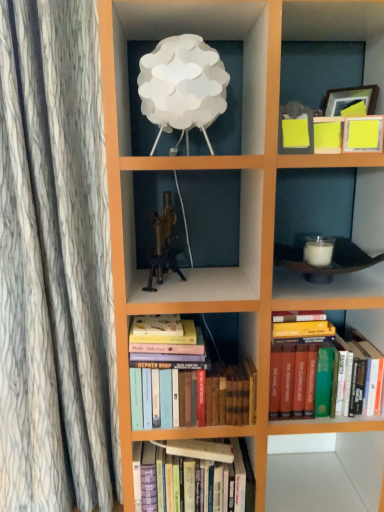
Question: In terms of height, does hardcover books at lower right, the 1th book in the top-to-bottom sequence, look taller or shorter compared to hardcover books at center, the second book when ordered from top to bottom?

Choices:
 (A) tall
 (B) short

Answer: (A)

Question: In the image, is hardcover books at lower right, the 3th book ordered from the bottom, on the left side or the right side of hardcover books at center, the second book in the bottom-to-top sequence?

Choices:
 (A) right
 (B) left

Answer: (A)

Question: Estimate the real-world distances between objects in this image. Which object is farther from the brass metallic tripod at center?

Choices:
 (A) white paper lampshade at upper center
 (B) hardcover books at lower right, the 1th book in the top-to-bottom sequence
 (C) hardcover books at center, the second book when ordered from top to bottom
 (D) hardcover books at center, acting as the 1th book starting from the bottom

Answer: (D)

Question: Which is nearer to the brass metallic tripod at center?

Choices:
 (A) white paper lampshade at upper center
 (B) hardcover books at center, acting as the 3th book starting from the top
 (C) hardcover books at lower right, the 1th book in the top-to-bottom sequence
 (D) hardcover books at center, the second book in the bottom-to-top sequence

Answer: (D)